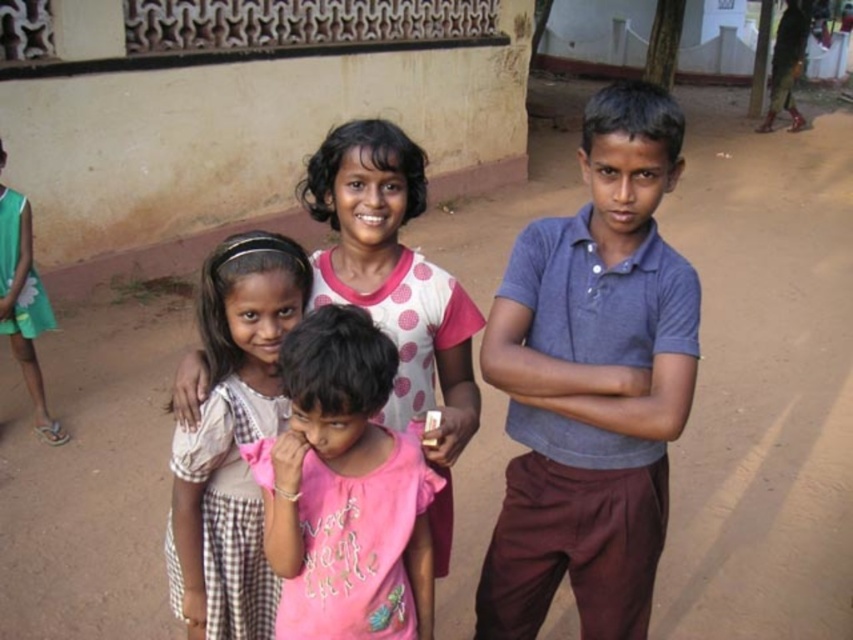
You are a photographer trying to capture a group photo of the children. You notice two boys wearing gray cotton shirt at center and pink cotton shirt at center. Which child should you position closer to the front to ensure both are visible in the photo?

Since the gray cotton shirt at center is much taller than the pink cotton shirt at center, you should position the child in the gray cotton shirt at center at the back and the child in the pink cotton shirt at center in the front to ensure both are visible in the photo.

You are standing at the point labeled point (315,611). You want to walk to the beige wall with a decorative black metal grill at the top. Is the distance from your current position to the beige wall with a decorative black metal grill at the top longer than 5.58 feet?

The distance from point (315,611) to the beige wall with a decorative black metal grill at the top is 5.58 feet, so yes, the distance is exactly 5.58 feet, which means it is not longer than that.